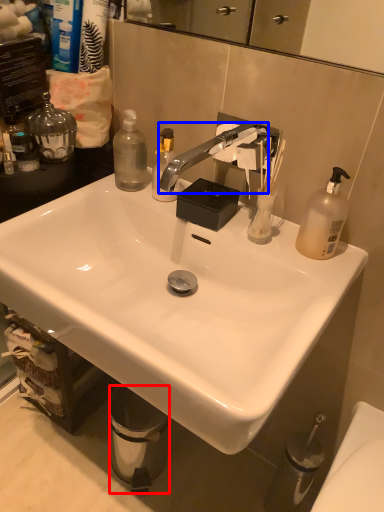
Question: Which point is further to the camera, trash bin/can (highlighted by a red box) or faucet (highlighted by a blue box)?

Choices:
 (A) trash bin/can
 (B) faucet

Answer: (A)